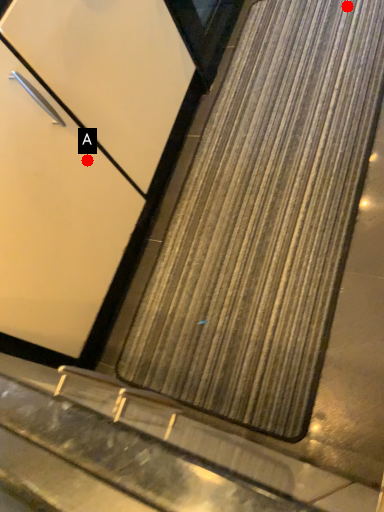
Question: Two points are circled on the image, labeled by A and B beside each circle. Which point appears closest to the camera in this image?

Choices:
 (A) A is closer
 (B) B is closer

Answer: (A)